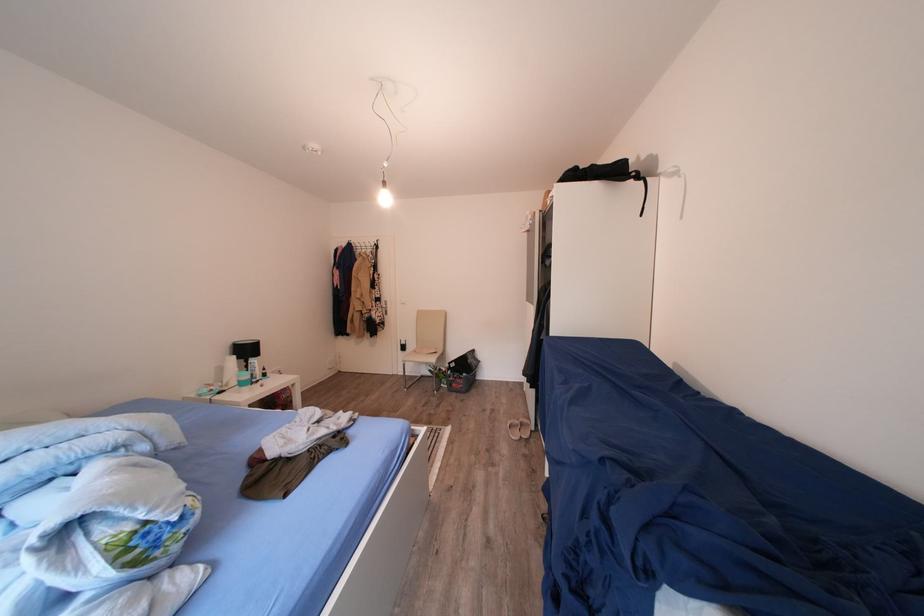
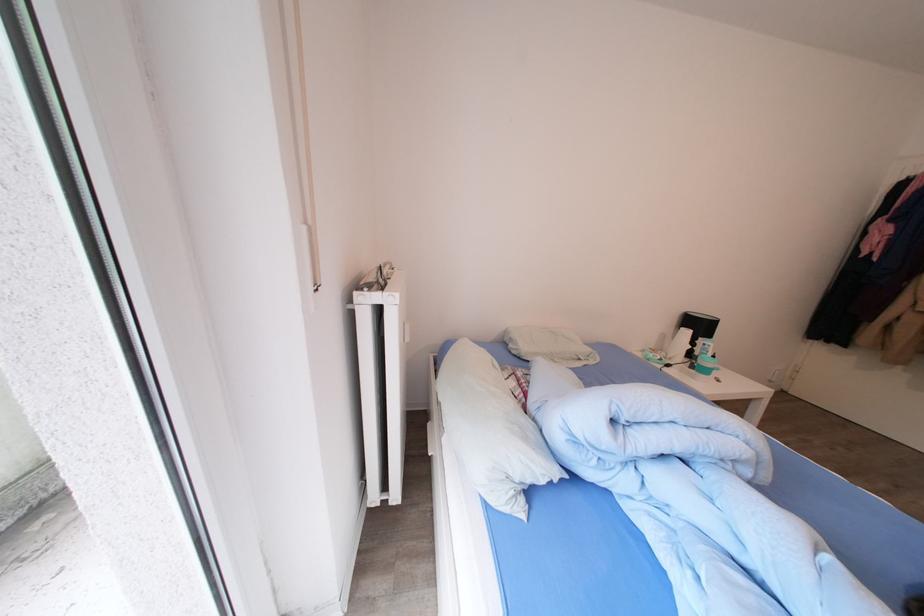
Find the pixel in the second image that matches (262,376) in the first image.

(712, 360)